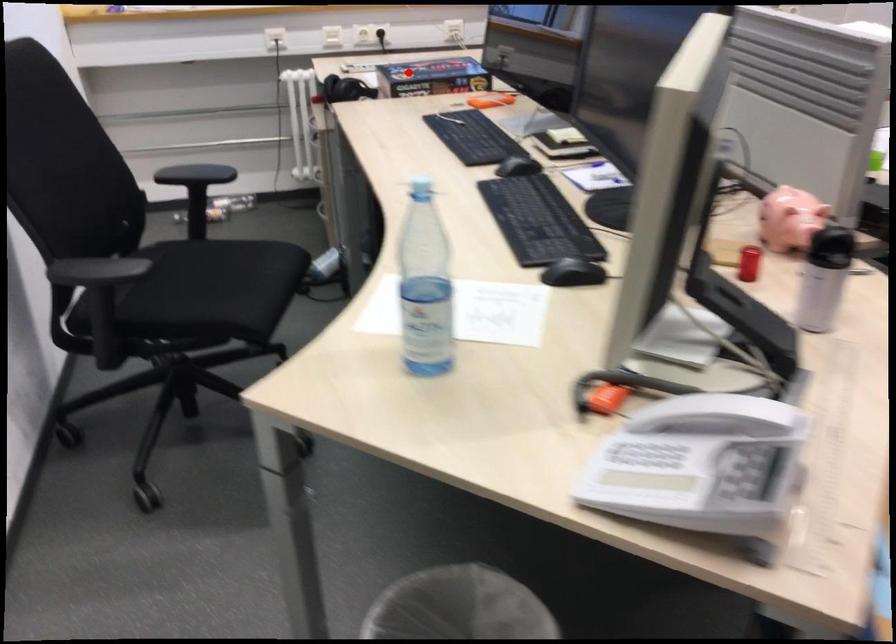
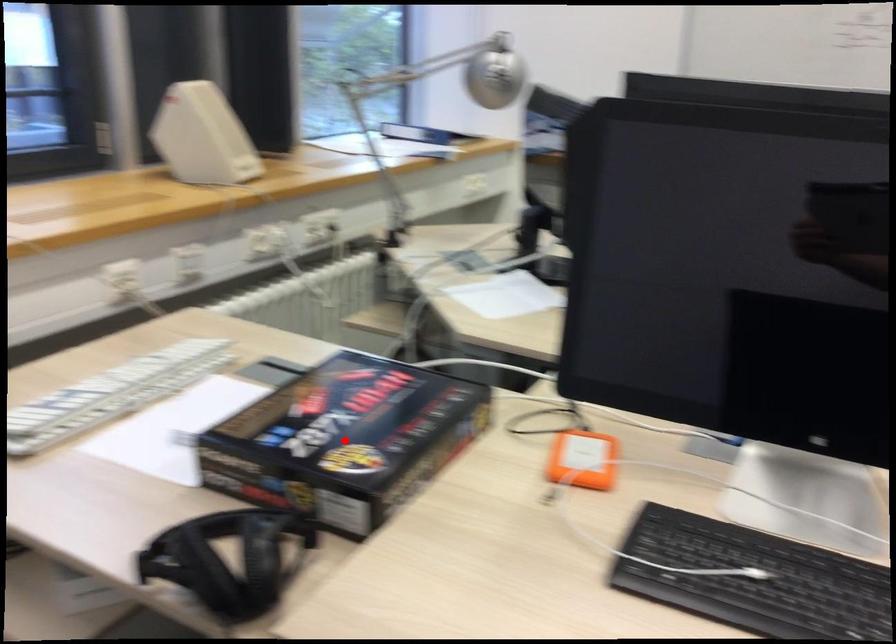
I am providing you with two images of the same scene from different viewpoints. A red point is marked on the first image and another point is marked on the second image. Is the marked point in image1 the same physical position as the marked point in image2?

Yes